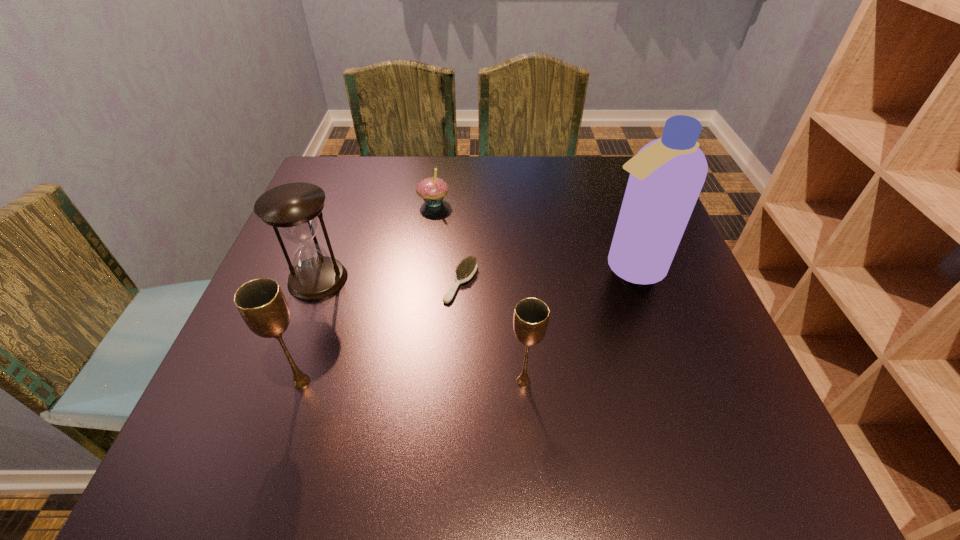
Find the location of a particular element. The width and height of the screenshot is (960, 540). free point between the hourglass and the taller chalice is located at coordinates (310, 330).

The width and height of the screenshot is (960, 540). In order to click on free space that is in between the right chalice and the hourglass in this screenshot , I will do `click(420, 330)`.

At what (x,y) coordinates should I click in order to perform the action: click on vacant space that is in between the fifth object from left to right and the taller chalice. Please return your answer as a coordinate pair (x, y). The width and height of the screenshot is (960, 540). Looking at the image, I should click on (413, 382).

Where is `empty space that is in between the rightmost object and the right chalice`? The height and width of the screenshot is (540, 960). empty space that is in between the rightmost object and the right chalice is located at coordinates (576, 325).

Locate an element on the screen. unoccupied area between the tallest object and the scrubbing brush is located at coordinates (545, 275).

Locate an element on the screen. This screenshot has width=960, height=540. vacant point located between the fourth object from left to right and the fourth object from right to left is located at coordinates (447, 242).

Locate an element on the screen. The image size is (960, 540). object that stands as the second closest to the shampoo is located at coordinates (465, 271).

Point out which object is positioned as the nearest to the hourglass. Please provide its 2D coordinates. Your answer should be formatted as a tuple, i.e. [(x, y)], where the tuple contains the x and y coordinates of a point satisfying the conditions above.

[(261, 303)]